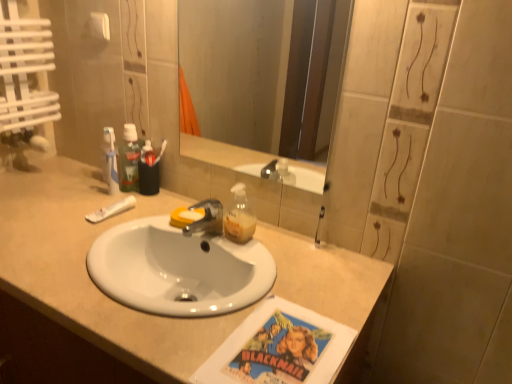
The image size is (512, 384). What are the coordinates of `free space above beige laminate countertop at center (from a real-world perspective)` in the screenshot? It's located at (132, 240).